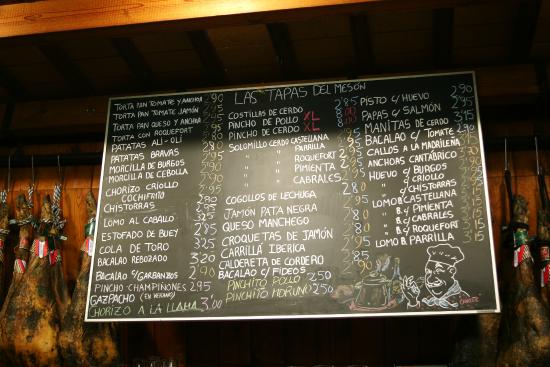
Where is `beam`? beam is located at coordinates (30, 13).